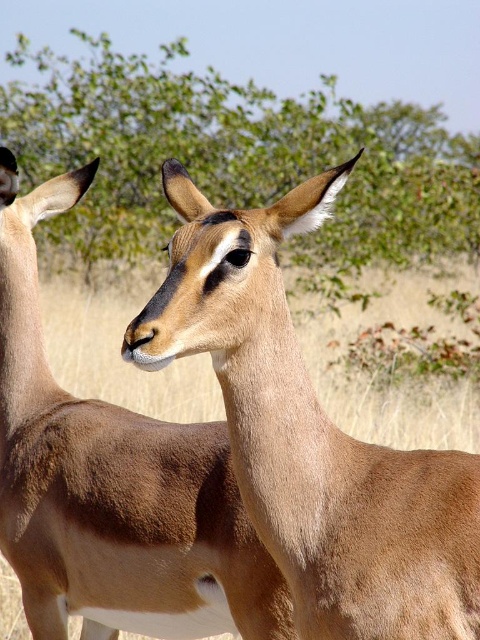
Based on the photo, you are standing in the savanna and see two points in the image. Which point is closer to you, point [216,184] or point [16,442]?

Point [216,184] is closer to you than point [16,442] because it is further to the viewer.

You are an antelope in the savanna and need to reach the green leafy tree at upper center to find shade. The light brown fur at center is your current location. Can you comfortably walk to the tree without any obstacles?

The distance between light brown fur at center and green leafy tree at upper center is 30.16 feet, which is a short distance for an antelope to walk comfortably to the tree without obstacles.

You are an antelope in the savanna and you want to reach the green leafy tree at upper center. Which direction should you move relative to your current position?

The green leafy tree at upper center is located at coordinates 0.244 on the x axis and 0.490 on the y axis. Since the tree is at upper center, the antelope should move towards the upper center direction to reach it.